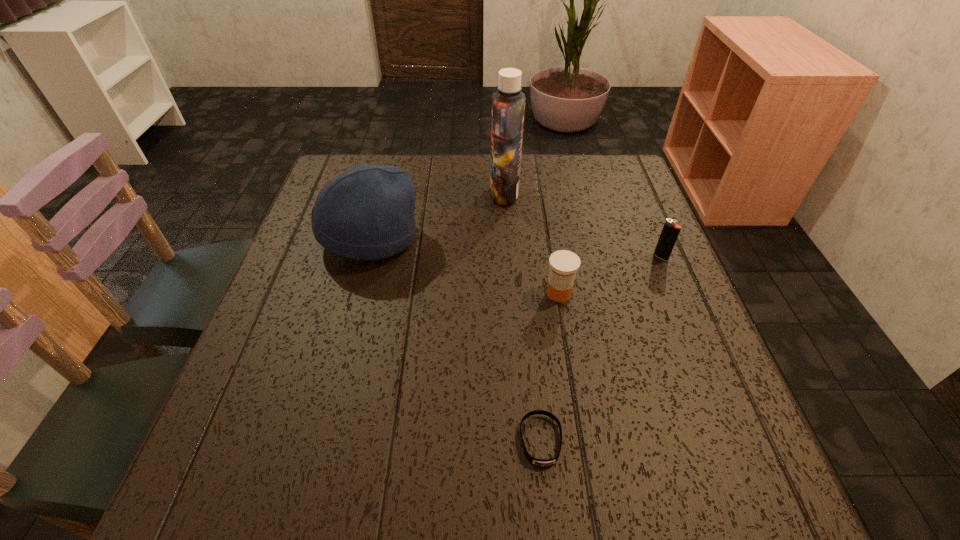
This screenshot has height=540, width=960. Find the location of `shampoo`. shampoo is located at coordinates (508, 103).

Where is `skullcap`? This screenshot has height=540, width=960. skullcap is located at coordinates (367, 212).

The width and height of the screenshot is (960, 540). I want to click on the second tallest object, so click(x=367, y=212).

Where is `igniter`? The height and width of the screenshot is (540, 960). igniter is located at coordinates (670, 231).

I want to click on medicine, so click(564, 264).

This screenshot has width=960, height=540. What are the coordinates of `the fourth object from left to right` in the screenshot? It's located at (564, 264).

The image size is (960, 540). Find the location of `the nearest object`. the nearest object is located at coordinates (539, 462).

This screenshot has width=960, height=540. Find the location of `the shortest object`. the shortest object is located at coordinates (539, 462).

Find the location of a particular element. This screenshot has height=540, width=960. vacant space situated 0.250m on the front label of the shampoo is located at coordinates (399, 193).

This screenshot has height=540, width=960. Find the location of `vacant space located on the front label of the shampoo`. vacant space located on the front label of the shampoo is located at coordinates [x=396, y=193].